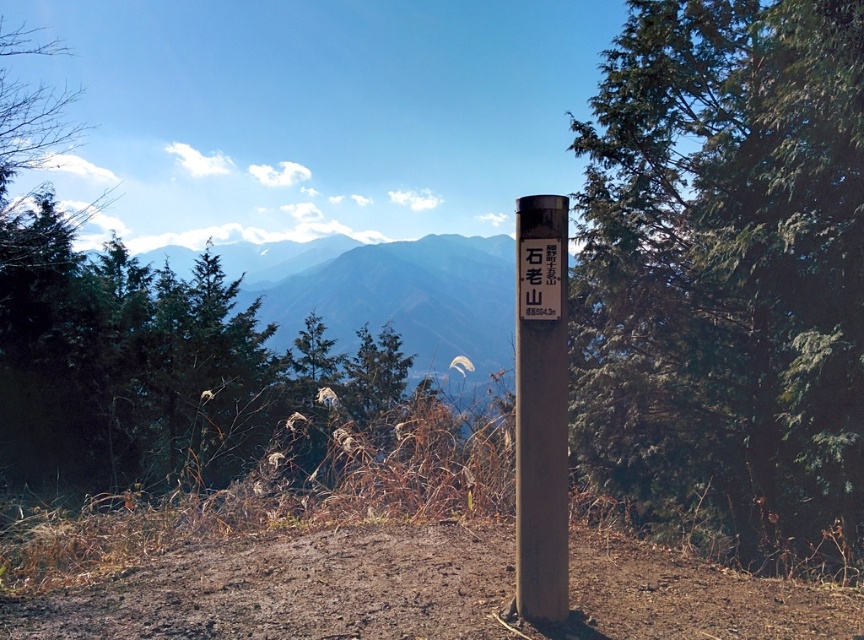
Can you confirm if green textured tree at center right is thinner than smooth brown signpost at center?

Incorrect, green textured tree at center right's width is not less than smooth brown signpost at center's.

Which is below, green textured tree at center right or smooth brown signpost at center?

Positioned lower is smooth brown signpost at center.

Who is more forward, (812, 541) or (523, 324)?

Positioned in front is point (523, 324).

Identify the location of green textured tree at center right. (726, 273).

Is point (525, 216) farther from viewer compared to point (545, 256)?

Yes, point (525, 216) is behind point (545, 256).

Can you confirm if smooth brown signpost at center is taller than matte black signpost at center?

Yes, smooth brown signpost at center is taller than matte black signpost at center.

This screenshot has height=640, width=864. In order to click on smooth brown signpost at center in this screenshot , I will do `click(541, 417)`.

Who is positioned more to the right, green textured tree at center right or matte black signpost at center?

green textured tree at center right

Between green textured tree at center right and matte black signpost at center, which one has less height?

With less height is matte black signpost at center.

Between point (834, 348) and point (545, 282), which one is positioned in front?

Point (545, 282)

Find the location of a particular element. The image size is (864, 640). green textured tree at center right is located at coordinates (726, 273).